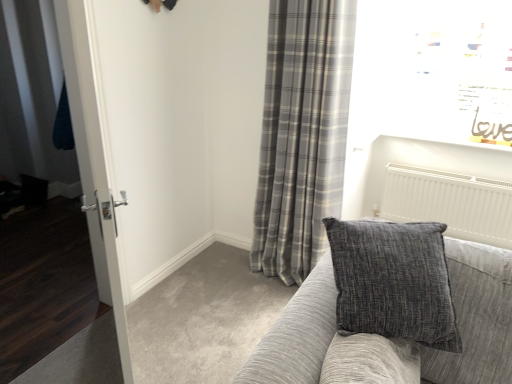
Image resolution: width=512 pixels, height=384 pixels. What do you see at coordinates (302, 133) in the screenshot?
I see `gray plaid curtain at center` at bounding box center [302, 133].

Where is `textured gray couch at center`? The height and width of the screenshot is (384, 512). textured gray couch at center is located at coordinates point(474,319).

From a real-world perspective, between gray plaid curtain at center and white glossy door at left, who is vertically higher?

From a 3D spatial view, gray plaid curtain at center is above.

Considering the relative sizes of gray plaid curtain at center and white glossy door at left in the image provided, is gray plaid curtain at center thinner than white glossy door at left?

No.

From the image's perspective, is gray plaid curtain at center located above or below white glossy door at left?

Based on their image positions, gray plaid curtain at center is located above white glossy door at left.

Does gray plaid curtain at center touch white glossy door at left?

No.

Which is more to the right, textured gray couch at center or white glossy door at left?

textured gray couch at center.

From a real-world perspective, which is physically below, textured gray couch at center or white glossy door at left?

In real-world perspective, textured gray couch at center is lower.

Is textured gray couch at center closer to the viewer compared to white glossy door at left?

Yes, it is.

From a real-world perspective, is white glossy door at left physically located above or below gray plaid curtain at center?

In terms of real-world spatial position, white glossy door at left is below gray plaid curtain at center.

In the scene shown: Can you tell me how much white glossy door at left and gray plaid curtain at center differ in facing direction?

35.5 degrees separate the facing orientations of white glossy door at left and gray plaid curtain at center.

In the scene shown: From the image's perspective, between white glossy door at left and gray plaid curtain at center, which one is located above?

gray plaid curtain at center.

Which of these two, white glossy door at left or gray plaid curtain at center, stands shorter?

white glossy door at left is shorter.

Is textured gray couch at center looking in the opposite direction of gray plaid curtain at center?

No, textured gray couch at center is not facing the opposite direction of gray plaid curtain at center.

From the image's perspective, which one is positioned higher, textured gray couch at center or gray plaid curtain at center?

gray plaid curtain at center, from the image's perspective.

How much distance is there between textured gray couch at center and gray plaid curtain at center?

A distance of 3.61 feet exists between textured gray couch at center and gray plaid curtain at center.

From a real-world perspective, does textured gray couch at center stand above gray plaid curtain at center?

No, from a real-world perspective, textured gray couch at center is not on top of gray plaid curtain at center.

Find the location of a particular element. The height and width of the screenshot is (384, 512). studio couch beneath the white glossy door at left (from a real-world perspective) is located at coordinates (x=474, y=319).

Does white glossy door at left appear on the left side of textured gray couch at center?

Indeed, white glossy door at left is positioned on the left side of textured gray couch at center.

Can you confirm if white glossy door at left is bigger than textured gray couch at center?

Actually, white glossy door at left might be smaller than textured gray couch at center.

From a real-world perspective, is white glossy door at left beneath textured gray couch at center?

No, from a real-world perspective, white glossy door at left is not beneath textured gray couch at center.

This screenshot has width=512, height=384. I want to click on studio couch in front of the gray plaid curtain at center, so click(474, 319).

Is gray plaid curtain at center facing towards textured gray couch at center?

No, gray plaid curtain at center is not facing towards textured gray couch at center.

Considering the relative sizes of gray plaid curtain at center and textured gray couch at center in the image provided, is gray plaid curtain at center taller than textured gray couch at center?

Yes, gray plaid curtain at center is taller than textured gray couch at center.

Locate an element on the screen. curtain above the white glossy door at left (from a real-world perspective) is located at coordinates (302, 133).

This screenshot has width=512, height=384. What are the coordinates of `studio couch located underneath the white glossy door at left (from a real-world perspective)` in the screenshot? It's located at (474, 319).

Estimate the real-world distances between objects in this image. Which object is closer to white glossy door at left, textured gray couch at center or gray plaid curtain at center?

textured gray couch at center lies closer to white glossy door at left than the other object.

Estimate the real-world distances between objects in this image. Which object is closer to textured gray couch at center, white glossy door at left or gray plaid curtain at center?

The object closer to textured gray couch at center is white glossy door at left.

Considering their positions, is gray plaid curtain at center positioned closer to textured gray couch at center than white glossy door at left?

white glossy door at left is closer to textured gray couch at center.

Looking at the image, which one is located further to white glossy door at left, gray plaid curtain at center or textured gray couch at center?

gray plaid curtain at center is positioned further to the anchor white glossy door at left.

Which object lies further to the anchor point gray plaid curtain at center, textured gray couch at center or white glossy door at left?

Among the two, textured gray couch at center is located further to gray plaid curtain at center.

Looking at the image, which one is located closer to gray plaid curtain at center, white glossy door at left or textured gray couch at center?

Based on the image, white glossy door at left appears to be nearer to gray plaid curtain at center.

Locate an element on the screen. glass door between textured gray couch at center and gray plaid curtain at center in the front-back direction is located at coordinates [93, 159].